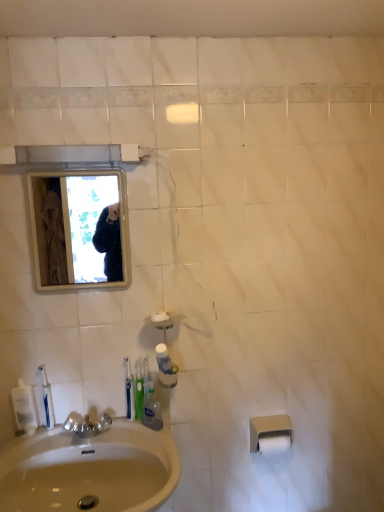
I want to click on vacant space to the right of clear plastic mouthwash at lower left, the 2th mouthwash when ordered from left to right, so point(84,438).